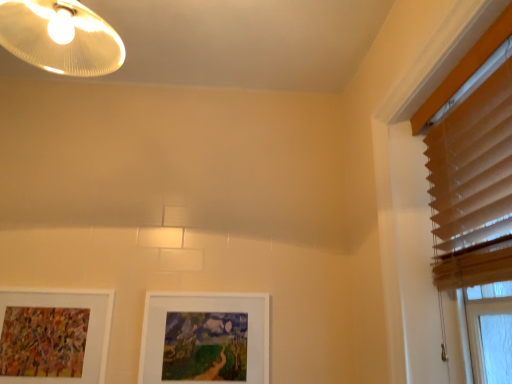
Question: Is white matte picture frame at center, acting as the first picture frame starting from the right, next to beige wood blinds at upper right?

Choices:
 (A) yes
 (B) no

Answer: (B)

Question: Considering the relative sizes of white matte picture frame at center, acting as the first picture frame starting from the right, and beige wood blinds at upper right in the image provided, is white matte picture frame at center, acting as the first picture frame starting from the right, shorter than beige wood blinds at upper right?

Choices:
 (A) yes
 (B) no

Answer: (A)

Question: Is white matte picture frame at center, the 2th picture frame in the left-to-right sequence, positioned before beige wood blinds at upper right?

Choices:
 (A) yes
 (B) no

Answer: (B)

Question: Is white matte picture frame at center, the 2th picture frame in the left-to-right sequence, oriented towards beige wood blinds at upper right?

Choices:
 (A) yes
 (B) no

Answer: (B)

Question: Considering the relative sizes of white matte picture frame at center, the 2th picture frame in the left-to-right sequence, and beige wood blinds at upper right in the image provided, is white matte picture frame at center, the 2th picture frame in the left-to-right sequence, bigger than beige wood blinds at upper right?

Choices:
 (A) yes
 (B) no

Answer: (B)

Question: From the image's perspective, is beige wood blinds at upper right located above or below matte white lampshade at upper left?

Choices:
 (A) above
 (B) below

Answer: (B)

Question: Visually, is beige wood blinds at upper right positioned to the left or to the right of matte white lampshade at upper left?

Choices:
 (A) left
 (B) right

Answer: (B)

Question: In the image, is beige wood blinds at upper right positioned in front of or behind matte white lampshade at upper left?

Choices:
 (A) behind
 (B) front

Answer: (B)

Question: From a real-world perspective, relative to matte white lampshade at upper left, is beige wood blinds at upper right vertically above or below?

Choices:
 (A) below
 (B) above

Answer: (A)

Question: Is beige wood blinds at upper right spatially inside white matte picture frame at center, acting as the first picture frame starting from the right, or outside of it?

Choices:
 (A) outside
 (B) inside

Answer: (A)

Question: In the image, is beige wood blinds at upper right positioned in front of or behind white matte picture frame at center, the 2th picture frame in the left-to-right sequence?

Choices:
 (A) front
 (B) behind

Answer: (A)

Question: From a real-world perspective, is beige wood blinds at upper right positioned above or below white matte picture frame at center, acting as the first picture frame starting from the right?

Choices:
 (A) below
 (B) above

Answer: (B)

Question: Considering the positions of point (501, 180) and point (147, 349), is point (501, 180) closer or farther from the camera than point (147, 349)?

Choices:
 (A) farther
 (B) closer

Answer: (B)

Question: From a real-world perspective, relative to beige wood blinds at upper right, is white matte picture frame at center, acting as the first picture frame starting from the right, vertically above or below?

Choices:
 (A) below
 (B) above

Answer: (A)

Question: From the image's perspective, is white matte picture frame at center, the 2th picture frame in the left-to-right sequence, located above or below beige wood blinds at upper right?

Choices:
 (A) above
 (B) below

Answer: (B)